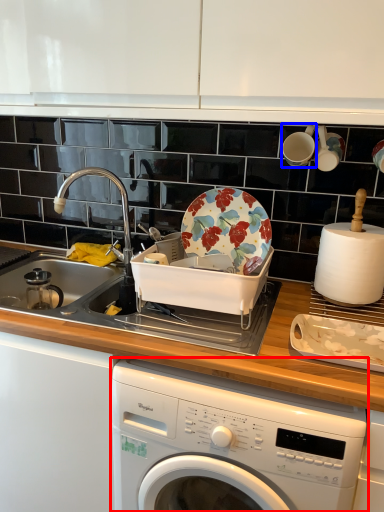
Question: Which object appears farthest to the camera in this image, washing machine (highlighted by a red box) or tableware (highlighted by a blue box)?

Choices:
 (A) washing machine
 (B) tableware

Answer: (B)